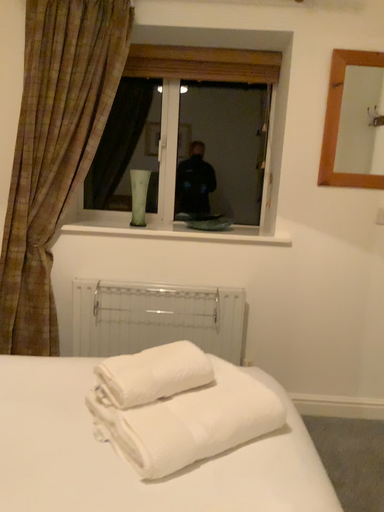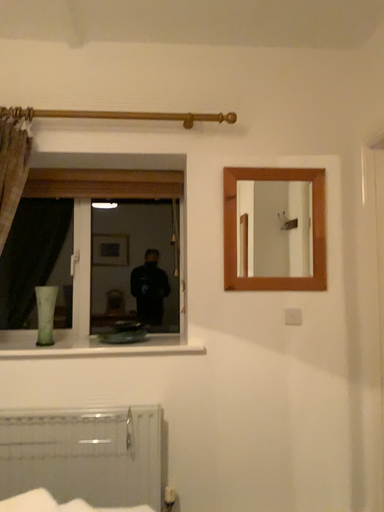
Question: How did the camera likely rotate when shooting the video?

Choices:
 (A) rotated upward
 (B) rotated downward

Answer: (A)